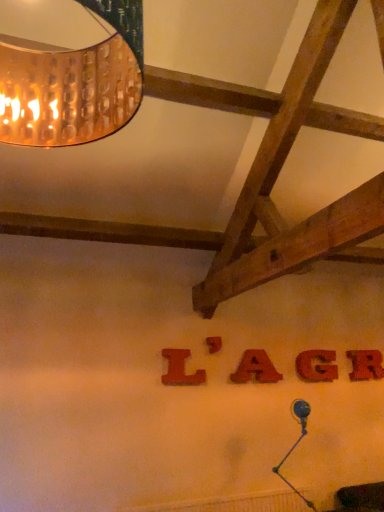
What are the coordinates of `copper textured lampshade at upper left` in the screenshot? It's located at (68, 69).

Identify the location of red wood letter at center, placed as the 1th letter when sorted from right to left. The width and height of the screenshot is (384, 512). (366, 365).

Describe the element at coordinates (316, 366) in the screenshot. The image size is (384, 512). I see `red matte letter g at center, marked as the 2th letter in a right-to-left arrangement` at that location.

Measure the distance between point (209, 342) and camera.

A distance of 10.16 feet exists between point (209, 342) and camera.

In order to click on copper textured lampshade at upper left in this screenshot , I will do `click(68, 69)`.

Is copper textured lampshade at upper left wider or thinner than red felt letter a at center, which is the 3th letter from right to left?

Clearly, copper textured lampshade at upper left has more width compared to red felt letter a at center, which is the 3th letter from right to left.

In order to click on lamp that appears in front of the red felt letter a at center, which is the 3th letter from right to left in this screenshot , I will do `click(68, 69)`.

Does copper textured lampshade at upper left touch red felt letter a at center, which ranks as the third letter in left-to-right order?

No, copper textured lampshade at upper left is not in contact with red felt letter a at center, which ranks as the third letter in left-to-right order.

From a real-world perspective, is matte red letter at center, the first letter viewed from the left, below red matte letter g at center, the 4th letter when ordered from left to right?

No.

Between point (177, 379) and point (309, 381), which one is positioned behind?

The point (309, 381) is farther.

Is matte red letter at center, which appears as the 5th letter when viewed from the right, to the left of red matte letter g at center, marked as the 2th letter in a right-to-left arrangement, from the viewer's perspective?

Indeed, matte red letter at center, which appears as the 5th letter when viewed from the right, is positioned on the left side of red matte letter g at center, marked as the 2th letter in a right-to-left arrangement.

Is matte red letter at center, which appears as the 5th letter when viewed from the right, placed right next to red matte letter g at center, marked as the 2th letter in a right-to-left arrangement?

matte red letter at center, which appears as the 5th letter when viewed from the right, and red matte letter g at center, marked as the 2th letter in a right-to-left arrangement, are not in contact.

From the image's perspective, which object appears higher, red wood letter at center, the fifth letter viewed from the left, or matte red letter at center, which appears as the 5th letter when viewed from the right?

matte red letter at center, which appears as the 5th letter when viewed from the right, is shown above in the image.

From the picture: Is red wood letter at center, placed as the 1th letter when sorted from right to left, in contact with matte red letter at center, which appears as the 5th letter when viewed from the right?

No, red wood letter at center, placed as the 1th letter when sorted from right to left, is not beside matte red letter at center, which appears as the 5th letter when viewed from the right.

Relative to matte red letter at center, the first letter viewed from the left, is red wood letter at center, the fifth letter viewed from the left, in front or behind?

red wood letter at center, the fifth letter viewed from the left, is positioned farther from the viewer than matte red letter at center, the first letter viewed from the left.

Considering the points (271, 377) and (208, 348), which point is behind, point (271, 377) or point (208, 348)?

The point (271, 377) is farther from the camera.

Is wooden letter at center, the second letter when ordered from left to right, at the back of red felt letter a at center, which ranks as the third letter in left-to-right order?

That's not correct — red felt letter a at center, which ranks as the third letter in left-to-right order, is not looking away from wooden letter at center, the second letter when ordered from left to right.

In terms of height, does red felt letter a at center, which ranks as the third letter in left-to-right order, look taller or shorter compared to wooden letter at center, the 4th letter in the right-to-left sequence?

Considering their sizes, red felt letter a at center, which ranks as the third letter in left-to-right order, has more height than wooden letter at center, the 4th letter in the right-to-left sequence.

Is red wood letter at center, the fifth letter viewed from the left, surrounding wooden letter at center, the 4th letter in the right-to-left sequence?

No, red wood letter at center, the fifth letter viewed from the left, does not contain wooden letter at center, the 4th letter in the right-to-left sequence.

Measure the distance between red wood letter at center, the fifth letter viewed from the left, and wooden letter at center, the 4th letter in the right-to-left sequence.

red wood letter at center, the fifth letter viewed from the left, is 1.27 meters from wooden letter at center, the 4th letter in the right-to-left sequence.

Which is more to the right, red wood letter at center, the fifth letter viewed from the left, or wooden letter at center, the 4th letter in the right-to-left sequence?

red wood letter at center, the fifth letter viewed from the left, is more to the right.

Looking at this image, is red wood letter at center, placed as the 1th letter when sorted from right to left, with wooden letter at center, the second letter when ordered from left to right?

No, red wood letter at center, placed as the 1th letter when sorted from right to left, is not making contact with wooden letter at center, the second letter when ordered from left to right.

Is red matte letter g at center, the 4th letter when ordered from left to right, completely or partially inside wooden letter at center, the second letter when ordered from left to right?

That's incorrect, red matte letter g at center, the 4th letter when ordered from left to right, is not inside wooden letter at center, the second letter when ordered from left to right.

Considering the relative sizes of wooden letter at center, the 4th letter in the right-to-left sequence, and red matte letter g at center, the 4th letter when ordered from left to right, in the image provided, is wooden letter at center, the 4th letter in the right-to-left sequence, bigger than red matte letter g at center, the 4th letter when ordered from left to right,?

Actually, wooden letter at center, the 4th letter in the right-to-left sequence, might be smaller than red matte letter g at center, the 4th letter when ordered from left to right.

Considering their positions, is wooden letter at center, the second letter when ordered from left to right, located in front of or behind red matte letter g at center, marked as the 2th letter in a right-to-left arrangement?

Visually, wooden letter at center, the second letter when ordered from left to right, is located in front of red matte letter g at center, marked as the 2th letter in a right-to-left arrangement.

This screenshot has width=384, height=512. In order to click on lamp that appears in front of the wooden letter at center, the 4th letter in the right-to-left sequence in this screenshot , I will do `click(68, 69)`.

Does wooden letter at center, the second letter when ordered from left to right, appear on the left side of copper textured lampshade at upper left?

No.

Is wooden letter at center, the second letter when ordered from left to right, surrounding copper textured lampshade at upper left?

No, copper textured lampshade at upper left is not a part of wooden letter at center, the second letter when ordered from left to right.

Is wooden letter at center, the 4th letter in the right-to-left sequence, directly adjacent to copper textured lampshade at upper left?

No, wooden letter at center, the 4th letter in the right-to-left sequence, is not making contact with copper textured lampshade at upper left.

From a real-world perspective, count 4th letters downward from the copper textured lampshade at upper left and point to it. Please provide its 2D coordinates.

[(255, 368)]

There is a matte red letter at center, which appears as the 5th letter when viewed from the right. At what (x,y) coordinates should I click in order to perform the action: click on the 2nd letter below it (from the image's perspective). Please return your answer as a coordinate pair (x, y). This screenshot has height=512, width=384. Looking at the image, I should click on (316, 366).

Based on their spatial positions, is red felt letter a at center, which ranks as the third letter in left-to-right order, or wooden letter at center, the second letter when ordered from left to right, further from red matte letter g at center, the 4th letter when ordered from left to right?

wooden letter at center, the second letter when ordered from left to right, lies further to red matte letter g at center, the 4th letter when ordered from left to right, than the other object.

Estimate the real-world distances between objects in this image. Which object is further from wooden letter at center, the 4th letter in the right-to-left sequence, red wood letter at center, the fifth letter viewed from the left, or red felt letter a at center, which is the 3th letter from right to left?

red wood letter at center, the fifth letter viewed from the left, is positioned further to the anchor wooden letter at center, the 4th letter in the right-to-left sequence.

Looking at the image, which one is located closer to red matte letter g at center, the 4th letter when ordered from left to right, red felt letter a at center, which is the 3th letter from right to left, or copper textured lampshade at upper left?

Among the two, red felt letter a at center, which is the 3th letter from right to left, is located nearer to red matte letter g at center, the 4th letter when ordered from left to right.

Looking at this image, from the image, which object appears to be nearer to wooden letter at center, the 4th letter in the right-to-left sequence, red wood letter at center, placed as the 1th letter when sorted from right to left, or matte red letter at center, the first letter viewed from the left?

Among the two, matte red letter at center, the first letter viewed from the left, is located nearer to wooden letter at center, the 4th letter in the right-to-left sequence.

Estimate the real-world distances between objects in this image. Which object is further from wooden letter at center, the 4th letter in the right-to-left sequence, copper textured lampshade at upper left or red felt letter a at center, which is the 3th letter from right to left?

Based on the image, copper textured lampshade at upper left appears to be further to wooden letter at center, the 4th letter in the right-to-left sequence.

Based on the photo, based on their spatial positions, is red matte letter g at center, the 4th letter when ordered from left to right, or red wood letter at center, placed as the 1th letter when sorted from right to left, closer to matte red letter at center, which appears as the 5th letter when viewed from the right?

red matte letter g at center, the 4th letter when ordered from left to right, is positioned closer to the anchor matte red letter at center, which appears as the 5th letter when viewed from the right.

Considering their positions, is matte red letter at center, which appears as the 5th letter when viewed from the right, positioned further to red matte letter g at center, the 4th letter when ordered from left to right, than red wood letter at center, placed as the 1th letter when sorted from right to left?

matte red letter at center, which appears as the 5th letter when viewed from the right, is positioned further to the anchor red matte letter g at center, the 4th letter when ordered from left to right.

Which object lies nearer to the anchor point red felt letter a at center, which ranks as the third letter in left-to-right order, wooden letter at center, the 4th letter in the right-to-left sequence, or red wood letter at center, the fifth letter viewed from the left?

The object closer to red felt letter a at center, which ranks as the third letter in left-to-right order, is wooden letter at center, the 4th letter in the right-to-left sequence.

Where is `letter between matte red letter at center, which appears as the 5th letter when viewed from the right, and red felt letter a at center, which is the 3th letter from right to left`? This screenshot has height=512, width=384. letter between matte red letter at center, which appears as the 5th letter when viewed from the right, and red felt letter a at center, which is the 3th letter from right to left is located at coordinates (214, 344).

Identify the location of letter between red felt letter a at center, which is the 3th letter from right to left, and red wood letter at center, the fifth letter viewed from the left. (316, 366).

Identify the location of letter located between wooden letter at center, the second letter when ordered from left to right, and red matte letter g at center, the 4th letter when ordered from left to right, in the left-right direction. This screenshot has height=512, width=384. (255, 368).

The height and width of the screenshot is (512, 384). What are the coordinates of `letter between copper textured lampshade at upper left and red felt letter a at center, which ranks as the third letter in left-to-right order, in the front-back direction` in the screenshot? It's located at (180, 369).